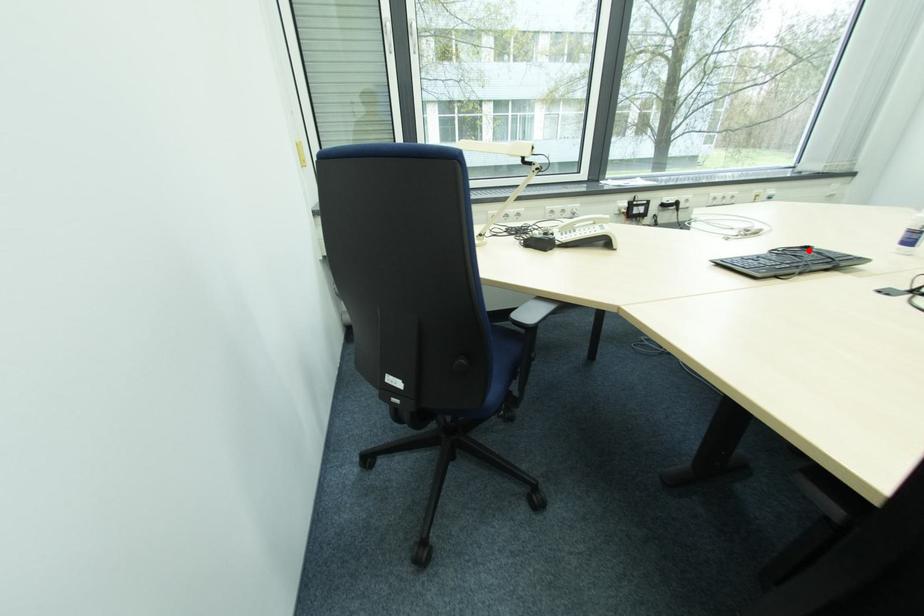
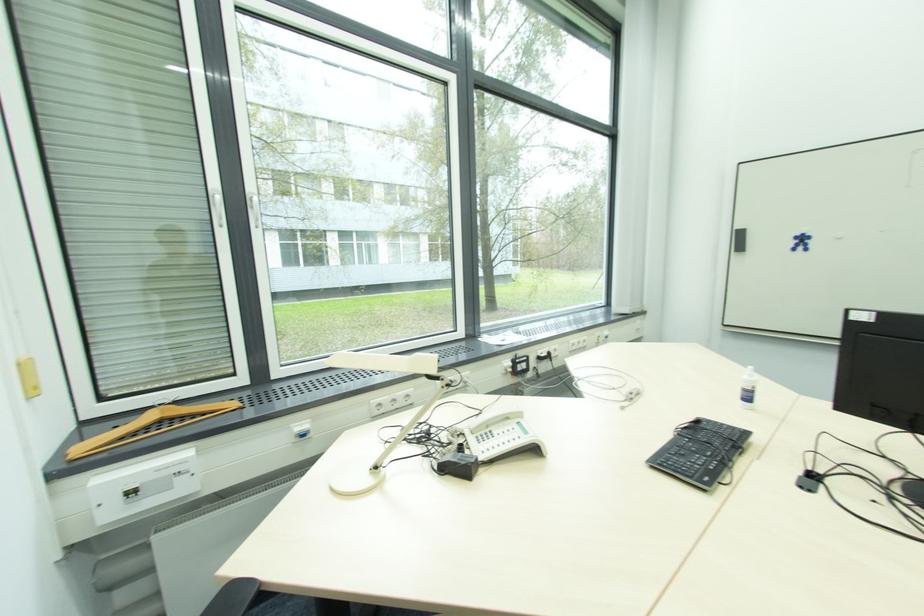
Locate, in the second image, the point that corresponds to the highlighted location in the first image.

(700, 424)